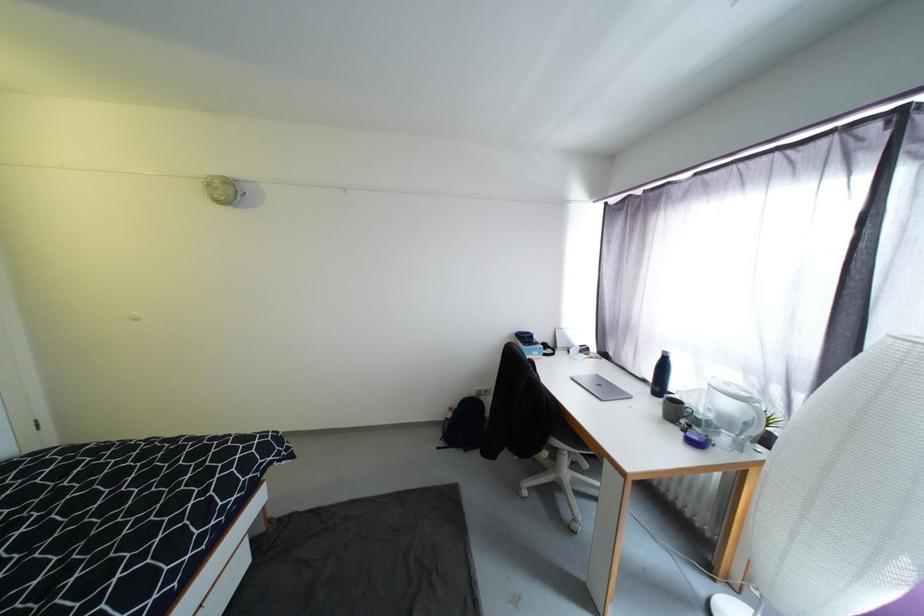
Find where to lift the water pitcher handle. Please return your answer as a coordinate pair (x, y).

(734, 408)